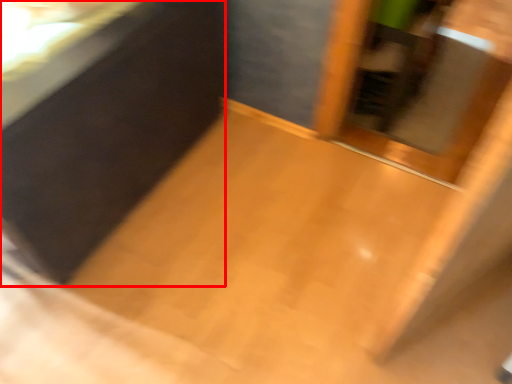
Question: From the image's perspective, what is the correct spatial relationship of vanity (annotated by the red box) in relation to screen door?

Choices:
 (A) below
 (B) above

Answer: (A)